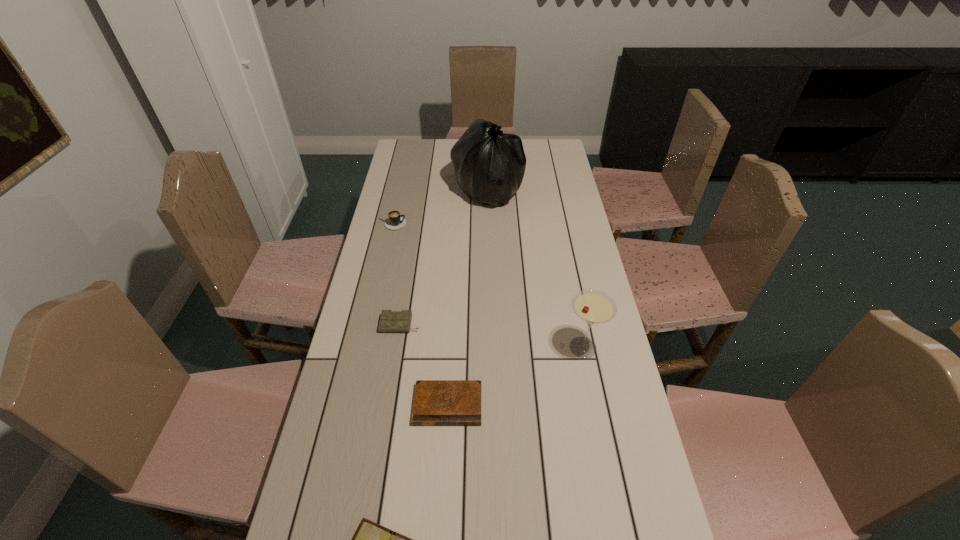
Locate an element on the screen. plastic bag is located at coordinates click(489, 165).

Identify the location of the farthest object. Image resolution: width=960 pixels, height=540 pixels. (489, 165).

You are a GUI agent. You are given a task and a screenshot of the screen. Output one action in this format:
    pyautogui.click(x=<x>, y=<y>)
    Task: Click on the martini
    The height and width of the screenshot is (540, 960).
    Given the screenshot: What is the action you would take?
    pyautogui.click(x=594, y=307)

Locate an element on the screen. the fifth shortest object is located at coordinates (594, 307).

You are a GUI agent. You are given a task and a screenshot of the screen. Output one action in this format:
    pyautogui.click(x=<x>, y=<y>)
    Task: Click on the cappuccino
    This screenshot has width=960, height=540.
    Given the screenshot: What is the action you would take?
    pyautogui.click(x=395, y=221)

You are a GUI agent. You are given a task and a screenshot of the screen. Output one action in this format:
    pyautogui.click(x=<x>, y=<y>)
    Task: Click on the second farthest object
    Image resolution: width=960 pixels, height=540 pixels.
    Given the screenshot: What is the action you would take?
    pyautogui.click(x=395, y=221)

Image resolution: width=960 pixels, height=540 pixels. What are the coordinates of `the third shortest object` in the screenshot? It's located at (390, 321).

Identify the location of the farthest diary. Image resolution: width=960 pixels, height=540 pixels. (390, 321).

Find the location of a particular element. This screenshot has height=540, width=960. the second farthest diary is located at coordinates click(x=436, y=402).

The image size is (960, 540). I want to click on vacant space positioned on the front of the tallest object, so click(x=489, y=224).